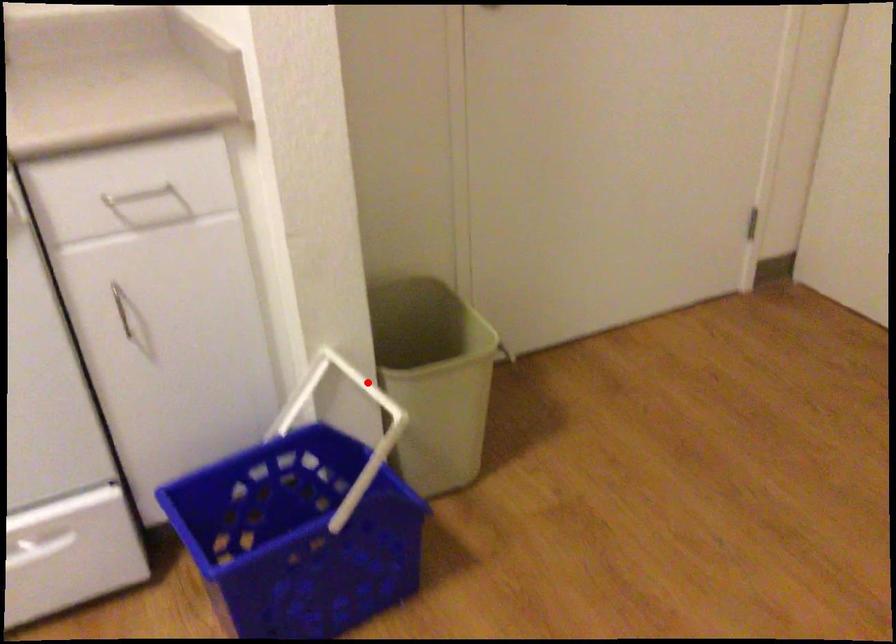
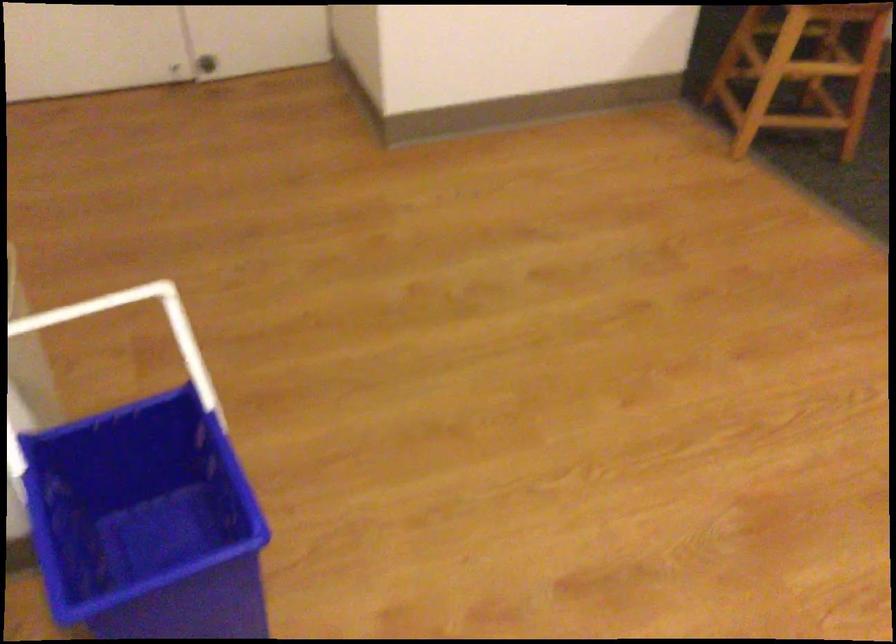
Find the pixel in the second image that matches the highlighted location in the first image.

(58, 316)